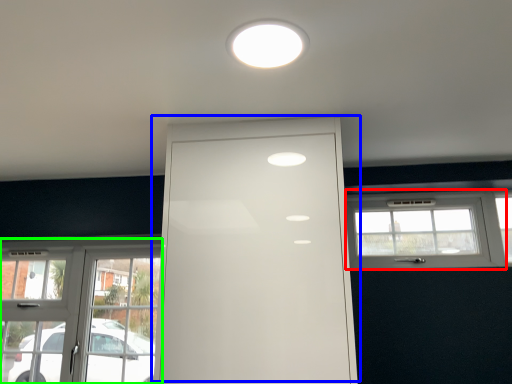
Question: Which object is the closest to the window (highlighted by a red box)? Choose among these: door (highlighted by a blue box) or window (highlighted by a green box).

Choices:
 (A) door
 (B) window

Answer: (A)